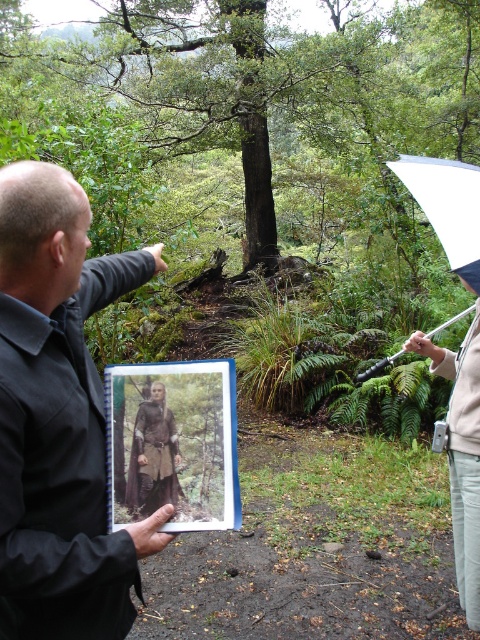
Question: Among these objects, which one is farthest from the camera?

Choices:
 (A) brown leather armor at center
 (B) white matte umbrella at upper right

Answer: (B)

Question: Which object is the farthest from the brown leather armor at center?

Choices:
 (A) white matte umbrella at upper right
 (B) dark brown leather jacket at upper left

Answer: (A)

Question: Does light beige pants at right lie behind brown leather armor at center?

Choices:
 (A) yes
 (B) no

Answer: (A)

Question: Can you confirm if light beige pants at right is positioned below brown leather armor at center?

Choices:
 (A) no
 (B) yes

Answer: (B)

Question: Is dark brown leather jacket at upper left behind white matte umbrella at upper right?

Choices:
 (A) yes
 (B) no

Answer: (B)

Question: Based on their relative distances, which object is farther from the white matte umbrella at upper right?

Choices:
 (A) light beige pants at right
 (B) dark brown leather jacket at upper left
 (C) brown leather armor at center

Answer: (B)